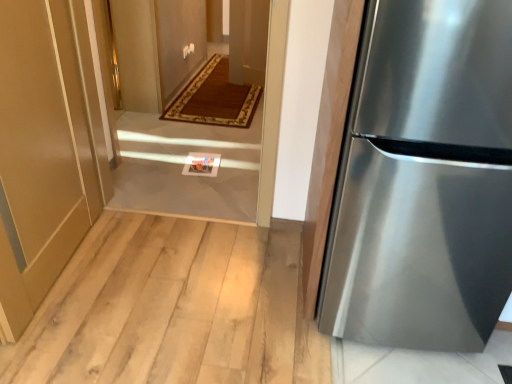
The width and height of the screenshot is (512, 384). Find the location of `free space that is to the left of stainless steel refrigerator at right`. free space that is to the left of stainless steel refrigerator at right is located at coordinates (271, 308).